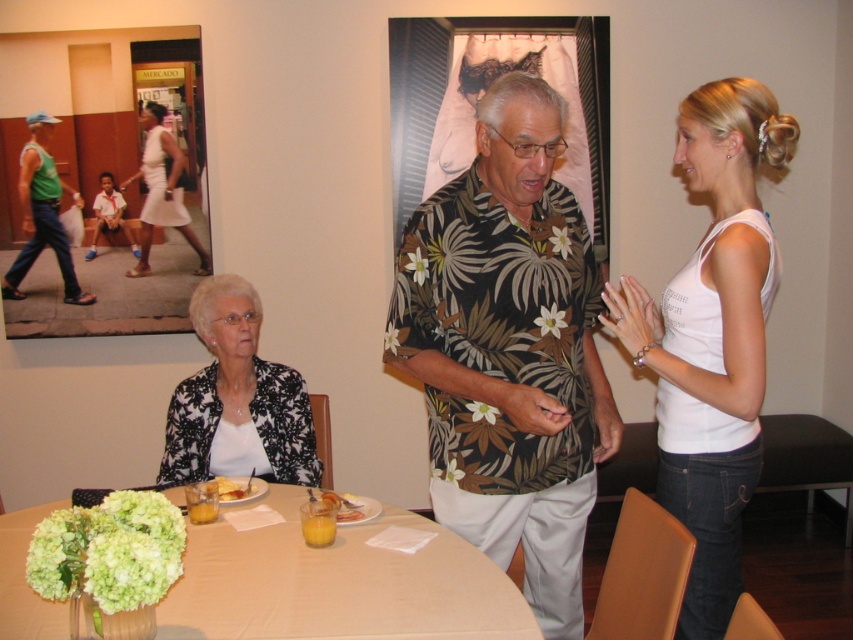
Question: Considering the real-world distances, which object is farthest from the black printed fabric at lower left?

Choices:
 (A) white satin dress at upper left
 (B) white cloth table at center
 (C) floral print shirt at center

Answer: (A)

Question: Which of the following is the closest to the observer?

Choices:
 (A) yellow matte plate at center
 (B) green fabric man at left

Answer: (A)

Question: Does floral print shirt at center lie behind green fabric shirt at left?

Choices:
 (A) no
 (B) yes

Answer: (A)

Question: Can you confirm if green fabric shirt at left is positioned below white satin dress at upper left?

Choices:
 (A) no
 (B) yes

Answer: (B)

Question: Which of the following is the farthest from the observer?

Choices:
 (A) yellow cake at table
 (B) green fabric man at left
 (C) floral print shirt at center
 (D) white cloth table at center

Answer: (B)

Question: Is white cotton tank top at right above green fabric man at left?

Choices:
 (A) yes
 (B) no

Answer: (B)